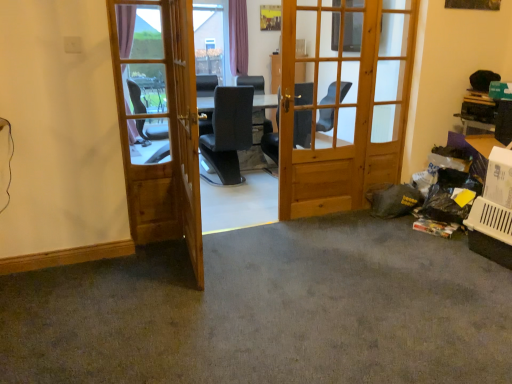
This screenshot has width=512, height=384. I want to click on free point below wooden door at left, placed as the 1th door when sorted from left to right (from a real-world perspective), so click(x=156, y=233).